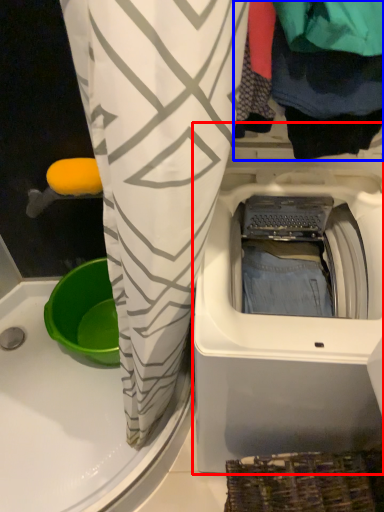
Question: Among these objects, which one is nearest to the camera, washing machine (highlighted by a red box) or clothing (highlighted by a blue box)?

Choices:
 (A) washing machine
 (B) clothing

Answer: (B)